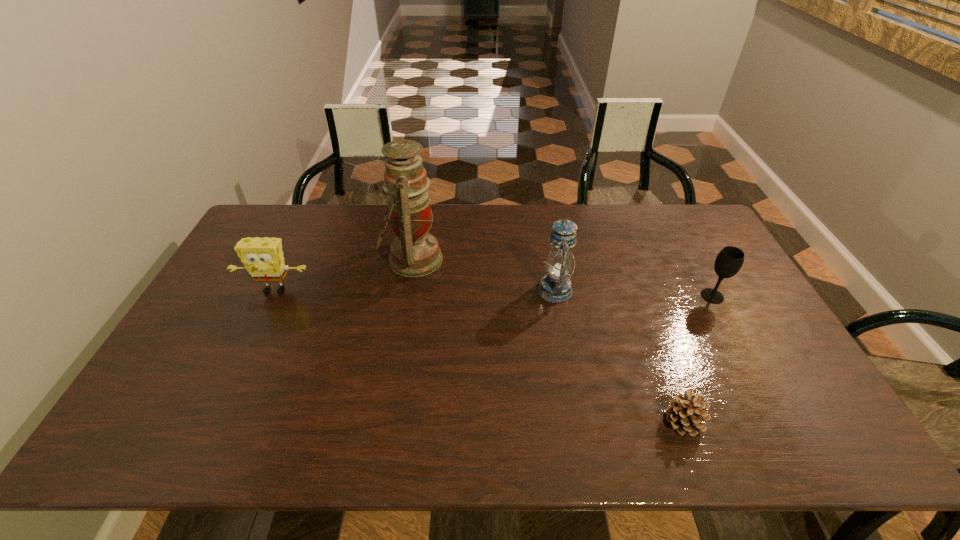
The width and height of the screenshot is (960, 540). Find the location of `free point at the near edge`. free point at the near edge is located at coordinates tap(632, 438).

Image resolution: width=960 pixels, height=540 pixels. What are the coordinates of `free region at the right edge` in the screenshot? It's located at 688,273.

Find the location of a particular element. The image size is (960, 540). vacant space at the far left corner of the desktop is located at coordinates (296, 206).

The width and height of the screenshot is (960, 540). In order to click on free space at the near left corner of the desktop in this screenshot , I will do `click(163, 441)`.

This screenshot has height=540, width=960. I want to click on free point between the third object from right to left and the leftmost object, so coord(415,290).

Locate an element on the screen. empty space that is in between the shortest object and the wineglass is located at coordinates (698, 359).

Locate an element on the screen. vacant region between the oil lamp and the sponge is located at coordinates (344, 274).

At what (x,y) coordinates should I click in order to perform the action: click on vacant space that's between the second object from left to right and the leftmost object. Please return your answer as a coordinate pair (x, y). Looking at the image, I should click on (344, 274).

Locate an element on the screen. The height and width of the screenshot is (540, 960). free space between the rightmost object and the second tallest object is located at coordinates (634, 293).

Where is `vacant region between the sponge and the tallest object`? This screenshot has height=540, width=960. vacant region between the sponge and the tallest object is located at coordinates (344, 274).